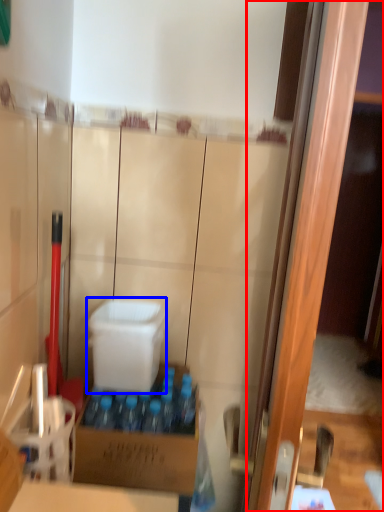
Question: Which object appears closest to the camera in this image, screen door (highlighted by a red box) or box (highlighted by a blue box)?

Choices:
 (A) screen door
 (B) box

Answer: (A)